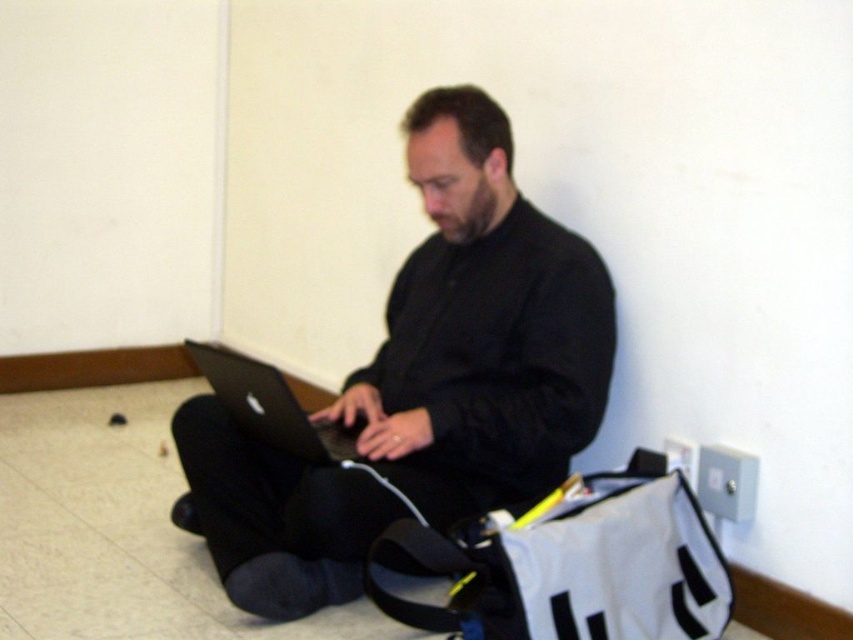
Question: Can you confirm if metallic gray electrical outlet at lower right is positioned below gray plastic electric outlet at lower right?

Choices:
 (A) no
 (B) yes

Answer: (B)

Question: Can you confirm if black matte laptop at center is thinner than metallic gray electrical outlet at lower right?

Choices:
 (A) no
 (B) yes

Answer: (A)

Question: Does silver metallic laptop at center appear over metallic gray electrical outlet at lower right?

Choices:
 (A) no
 (B) yes

Answer: (B)

Question: Which point is closer to the camera?

Choices:
 (A) metallic gray electrical outlet at lower right
 (B) black matte laptop at center
 (C) silver metallic laptop at center

Answer: (C)

Question: Which object is farther from the camera taking this photo?

Choices:
 (A) silver metallic laptop at center
 (B) metallic gray electrical outlet at lower right

Answer: (B)

Question: Considering the real-world distances, which object is farthest from the black matte laptop at center?

Choices:
 (A) gray plastic electric outlet at lower right
 (B) metallic gray electrical outlet at lower right

Answer: (A)